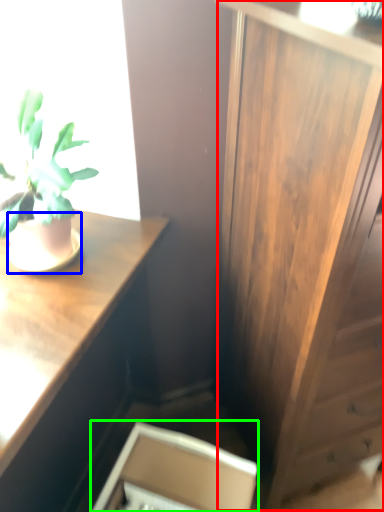
Question: Which object is the closest to the side cabinet (highlighted by a red box)? Choose among these: flowerpot (highlighted by a blue box) or cabinetry (highlighted by a green box).

Choices:
 (A) flowerpot
 (B) cabinetry

Answer: (B)